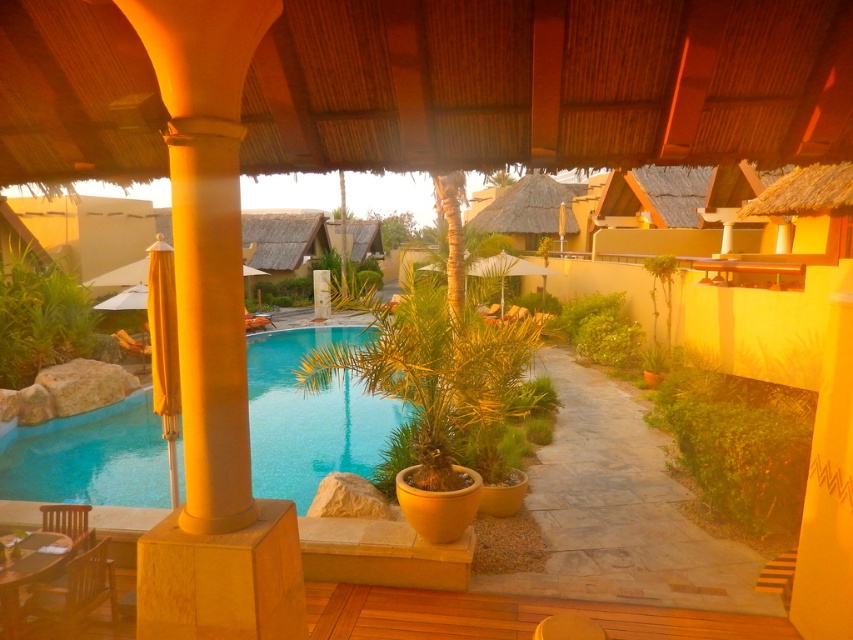
You are planning to place a small statue between the green leafy plant at left and the wooden chair at lower left. Considering their heights, which object should the statue be placed closer to?

The statue should be placed closer to the wooden chair at lower left because the green leafy plant at left is much taller, so positioning the statue near the shorter wooden chair at lower left would create a more balanced arrangement.

You are standing at the center of the wooden deck and want to locate the matte yellow column at left. According to the coordinates provided, in which direction should you look to find it?

The matte yellow column at left is located at coordinates point (212, 346). Since you are at the center of the wooden deck, you should look to your left to find the matte yellow column at left.

You are standing at the center of the wooden deck and want to place a small potted plant exactly at the point marked by coordinates point (x=39, y=317). Based on the scene description, what object is located at that point?

The point (x=39, y=317) corresponds to the green leafy plant at left, so placing the potted plant there would position it near the existing green leafy plant at left.